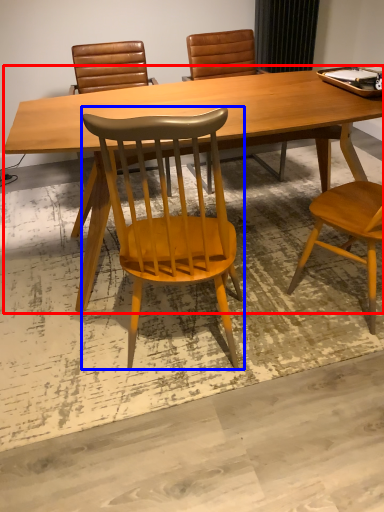
Question: Which point is further to the camera, desk (highlighted by a red box) or chair (highlighted by a blue box)?

Choices:
 (A) desk
 (B) chair

Answer: (A)